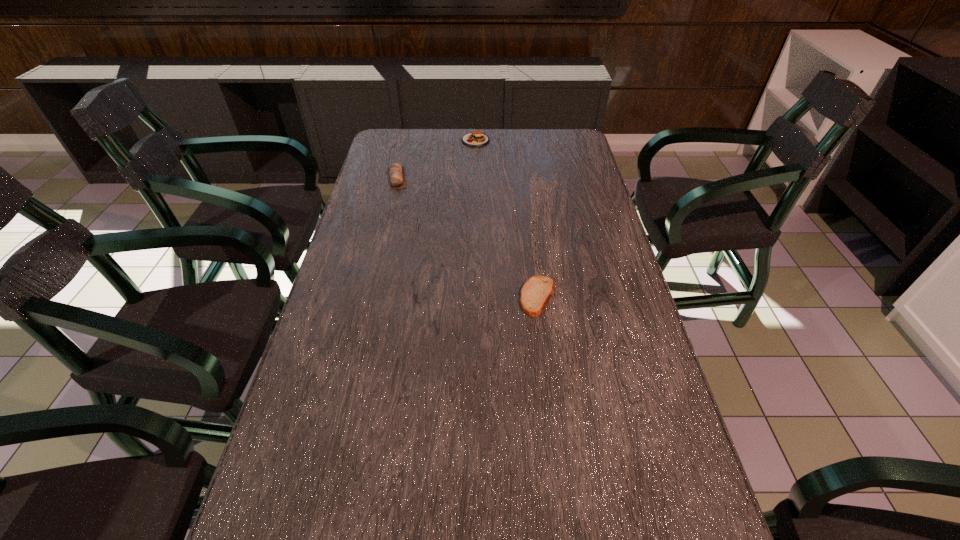
In order to click on vacant space that satisfies the following two spatial constraints: 1. on the front side of the patty (food); 2. on the left side of the shorter pita bread in this screenshot , I will do click(x=473, y=296).